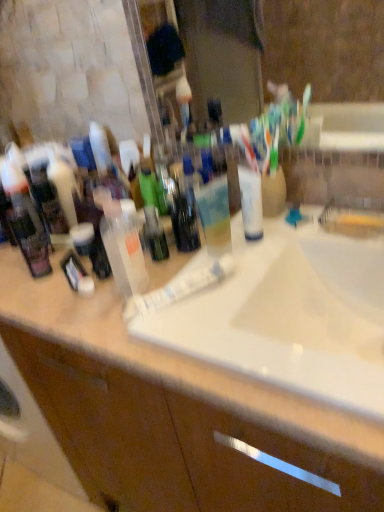
Question: From a real-world perspective, is brown wood bathroom cabinet at center positioned under translucent plastic spray bottle at center based on gravity?

Choices:
 (A) yes
 (B) no

Answer: (A)

Question: Is brown wood bathroom cabinet at center completely or partially outside of translucent plastic spray bottle at center?

Choices:
 (A) no
 (B) yes

Answer: (B)

Question: Does brown wood bathroom cabinet at center have a larger size compared to translucent plastic spray bottle at center?

Choices:
 (A) yes
 (B) no

Answer: (A)

Question: Considering the relative sizes of brown wood bathroom cabinet at center and translucent plastic spray bottle at center in the image provided, is brown wood bathroom cabinet at center taller than translucent plastic spray bottle at center?

Choices:
 (A) no
 (B) yes

Answer: (B)

Question: Does brown wood bathroom cabinet at center touch translucent plastic spray bottle at center?

Choices:
 (A) yes
 (B) no

Answer: (B)

Question: From the image's perspective, is brown wood bathroom cabinet at center on translucent plastic spray bottle at center?

Choices:
 (A) yes
 (B) no

Answer: (B)

Question: Can we say white glossy sink at center lies outside translucent plastic bottle at center?

Choices:
 (A) no
 (B) yes

Answer: (B)

Question: Is white glossy sink at center taller than translucent plastic bottle at center?

Choices:
 (A) no
 (B) yes

Answer: (A)

Question: Does white glossy sink at center lie in front of translucent plastic bottle at center?

Choices:
 (A) no
 (B) yes

Answer: (B)

Question: Can you confirm if white glossy sink at center is smaller than translucent plastic bottle at center?

Choices:
 (A) no
 (B) yes

Answer: (A)

Question: Can you see white glossy sink at center touching translucent plastic bottle at center?

Choices:
 (A) no
 (B) yes

Answer: (A)

Question: Is white glossy sink at center shorter than translucent plastic bottle at center?

Choices:
 (A) yes
 (B) no

Answer: (A)

Question: Is black matte toothbrush at left, the third toiletry when ordered from right to left, far from translucent plastic bottle at center?

Choices:
 (A) yes
 (B) no

Answer: (B)